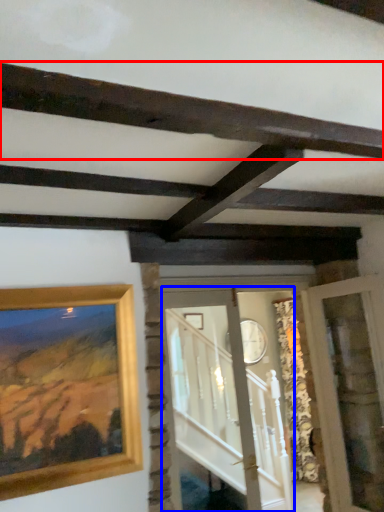
Question: Which point is closer to the camera, plank (highlighted by a red box) or glass door (highlighted by a blue box)?

Choices:
 (A) plank
 (B) glass door

Answer: (A)